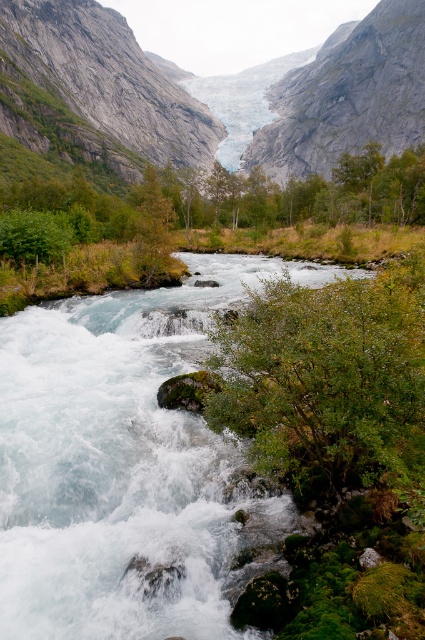
You are a hiker standing at the edge of the river and looking towards the gray rock mountain at center and the green leafy bush at lower center. Which object is closer to you?

The green leafy bush at lower center is closer to you because it is positioned in front of the gray rock mountain at center, which is further away.

You are a hiker standing at the bottom left corner of the valley. You want to reach the gray rock mountain at center. Which direction should you head towards?

You should head towards the center right direction to reach the gray rock mountain at center.